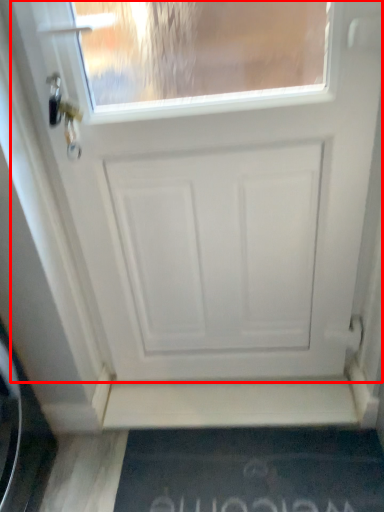
Question: From the image's perspective, what is the correct spatial relationship of door (annotated by the red box) in relation to doormat?

Choices:
 (A) below
 (B) above

Answer: (B)